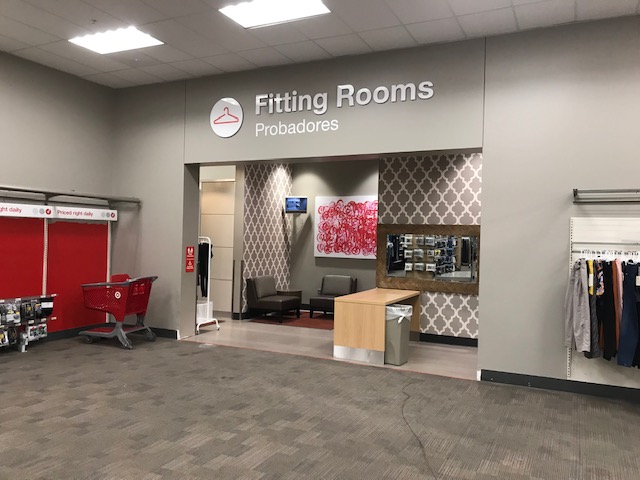
At what (x,y) coordinates should I click in order to perform the action: click on room. Please return your answer as a coordinate pair (x, y). The height and width of the screenshot is (480, 640). Looking at the image, I should click on click(x=371, y=91).